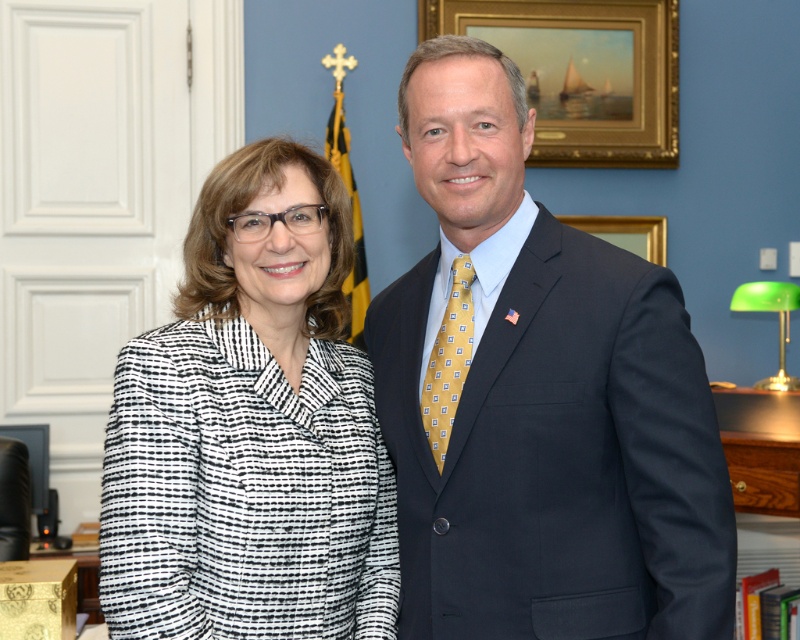
Find the location of a particular element. wooden bookshelf at lower right is located at coordinates (760, 448).

How distant is wooden bookshelf at lower right from gold wooden picture frame at upper right?

wooden bookshelf at lower right is 1.03 meters away from gold wooden picture frame at upper right.

This screenshot has width=800, height=640. Find the location of `wooden bookshelf at lower right`. wooden bookshelf at lower right is located at coordinates (760, 448).

Does point (229, 445) lie in front of point (638, 250)?

Yes, it is in front of point (638, 250).

Does point (172, 342) come farther from viewer compared to point (586, 228)?

No, (172, 342) is closer to viewer.

Find the location of a particular element. The height and width of the screenshot is (640, 800). black textured blazer at center is located at coordinates (250, 436).

Where is `black textured blazer at center`? black textured blazer at center is located at coordinates (250, 436).

Is gold/gilded picture frame at upper center positioned behind wooden bookshelf at lower right?

Yes, it is behind wooden bookshelf at lower right.

Locate an element on the screen. gold/gilded picture frame at upper center is located at coordinates (584, 72).

Where is `gold/gilded picture frame at upper center`? gold/gilded picture frame at upper center is located at coordinates (584, 72).